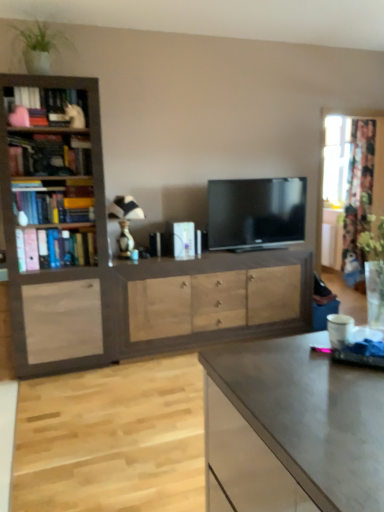
Question: Is black glossy tv at center not inside wooden bookcase at left?

Choices:
 (A) yes
 (B) no

Answer: (A)

Question: Does black glossy tv at center come behind wooden bookcase at left?

Choices:
 (A) no
 (B) yes

Answer: (B)

Question: Would you say black glossy tv at center is a long distance from wooden bookcase at left?

Choices:
 (A) no
 (B) yes

Answer: (B)

Question: Considering the relative sizes of black glossy tv at center and wooden bookcase at left in the image provided, is black glossy tv at center taller than wooden bookcase at left?

Choices:
 (A) no
 (B) yes

Answer: (A)

Question: Could you tell me if black glossy tv at center is turned towards wooden bookcase at left?

Choices:
 (A) yes
 (B) no

Answer: (B)

Question: In terms of width, does wooden bookcase at left look wider or thinner when compared to green leafy plant at upper left?

Choices:
 (A) thin
 (B) wide

Answer: (B)

Question: Is point (13, 145) positioned closer to the camera than point (29, 61)?

Choices:
 (A) closer
 (B) farther

Answer: (B)

Question: From a real-world perspective, relative to green leafy plant at upper left, is wooden bookcase at left vertically above or below?

Choices:
 (A) below
 (B) above

Answer: (A)

Question: Do you think wooden bookcase at left is within green leafy plant at upper left, or outside of it?

Choices:
 (A) inside
 (B) outside

Answer: (B)

Question: Would you say floral fabric curtain at right is inside or outside light wood drawer at center?

Choices:
 (A) outside
 (B) inside

Answer: (A)

Question: From a real-world perspective, is floral fabric curtain at right above or below light wood drawer at center?

Choices:
 (A) below
 (B) above

Answer: (B)

Question: Considering their positions, is floral fabric curtain at right located in front of or behind light wood drawer at center?

Choices:
 (A) behind
 (B) front

Answer: (A)

Question: Looking at their shapes, would you say floral fabric curtain at right is wider or thinner than light wood drawer at center?

Choices:
 (A) wide
 (B) thin

Answer: (B)

Question: Choose the correct answer: Is light wood drawer at center inside white striped fabric lampshade at center or outside it?

Choices:
 (A) inside
 (B) outside

Answer: (B)

Question: From a real-world perspective, is light wood drawer at center physically located above or below white striped fabric lampshade at center?

Choices:
 (A) above
 (B) below

Answer: (B)